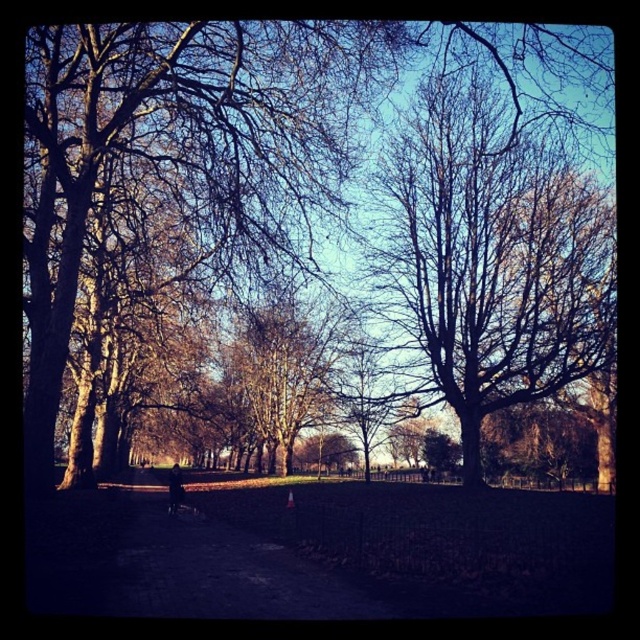
Consider the image. Is bare wood tree at center to the left of dark asphalt path at center from the viewer's perspective?

No, bare wood tree at center is not to the left of dark asphalt path at center.

Does bare wood tree at center have a smaller size compared to dark asphalt path at center?

Actually, bare wood tree at center might be larger than dark asphalt path at center.

Find the location of a particular element. The width and height of the screenshot is (640, 640). bare wood tree at center is located at coordinates (486, 256).

Identify the location of bare wood tree at center. (486, 256).

Can you confirm if brown leafless tree at center is positioned to the left of bare wood tree at center?

Correct, you'll find brown leafless tree at center to the left of bare wood tree at center.

Does point (138, 93) come closer to viewer compared to point (394, 317)?

Yes, it is in front of point (394, 317).

Locate an element on the screen. The image size is (640, 640). brown leafless tree at center is located at coordinates (189, 150).

You are a GUI agent. You are given a task and a screenshot of the screen. Output one action in this format:
    pyautogui.click(x=<x>, y=<y>)
    Task: Click on the brown leafless tree at center
    The image size is (640, 640).
    Given the screenshot: What is the action you would take?
    click(189, 150)

Is brown leafless tree at center positioned behind smooth bark tree at center?

No, it is in front of smooth bark tree at center.

Is point (65, 273) farther from camera compared to point (292, 296)?

No, (65, 273) is in front of (292, 296).

Describe the element at coordinates (189, 150) in the screenshot. The image size is (640, 640). I see `brown leafless tree at center` at that location.

The width and height of the screenshot is (640, 640). In order to click on brown leafless tree at center in this screenshot , I will do `click(189, 150)`.